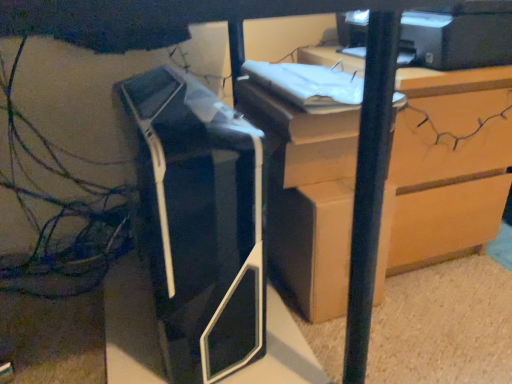
Question: Relative to matte cardboard box at center, is black plastic printer at center, marked as the first printer in a bottom-to-top arrangement, in front or behind?

Choices:
 (A) behind
 (B) front

Answer: (B)

Question: Based on their sizes in the image, would you say black plastic printer at center, the second printer when ordered from right to left, is bigger or smaller than matte cardboard box at center?

Choices:
 (A) small
 (B) big

Answer: (B)

Question: Based on their relative distances, which object is farther from the black plastic printer at center, arranged as the 2th printer when viewed from the top?

Choices:
 (A) wooden chest of drawers at upper right
 (B) matte cardboard box at center
 (C) matte black printer at upper right, which is the 1th printer from top to bottom

Answer: (C)

Question: Which is farther from the matte cardboard box at center?

Choices:
 (A) matte black printer at upper right, the 2th printer positioned from the bottom
 (B) wooden chest of drawers at upper right
 (C) black plastic printer at center, the second printer when ordered from right to left

Answer: (A)